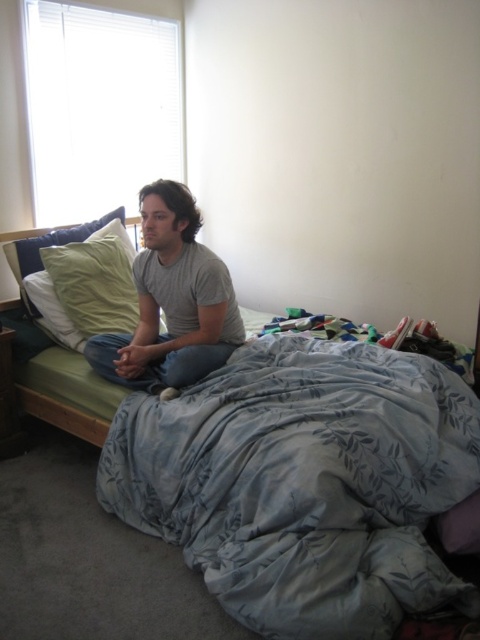
Which is in front, point (180, 241) or point (72, 320)?

Point (180, 241) is more forward.

Between point (160, 188) and point (116, 326), which one is positioned behind?

The point (116, 326) is more distant.

Identify the location of gray cotton shirt at center. This screenshot has height=640, width=480. (171, 301).

Is blue leaf-patterned blanket at center smaller than gray cotton shirt at center?

No, blue leaf-patterned blanket at center is not smaller than gray cotton shirt at center.

Based on the photo, can you confirm if blue leaf-patterned blanket at center is bigger than gray cotton shirt at center?

Correct, blue leaf-patterned blanket at center is larger in size than gray cotton shirt at center.

Where is `blue leaf-patterned blanket at center`? The height and width of the screenshot is (640, 480). blue leaf-patterned blanket at center is located at coordinates (303, 483).

Is blue leaf-patterned blanket at center wider than green fabric pillow at upper left?

Yes, blue leaf-patterned blanket at center is wider than green fabric pillow at upper left.

Which is more to the right, blue leaf-patterned blanket at center or green fabric pillow at upper left?

blue leaf-patterned blanket at center is more to the right.

Is point (151, 419) less distant than point (130, 316)?

Yes.

At what (x,y) coordinates should I click in order to perform the action: click on blue leaf-patterned blanket at center. Please return your answer as a coordinate pair (x, y). This screenshot has height=640, width=480. Looking at the image, I should click on (303, 483).